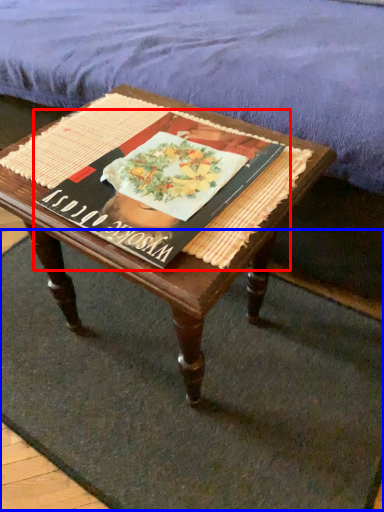
Question: Which point is further to the camera, paperback book (highlighted by a red box) or doormat (highlighted by a blue box)?

Choices:
 (A) paperback book
 (B) doormat

Answer: (B)